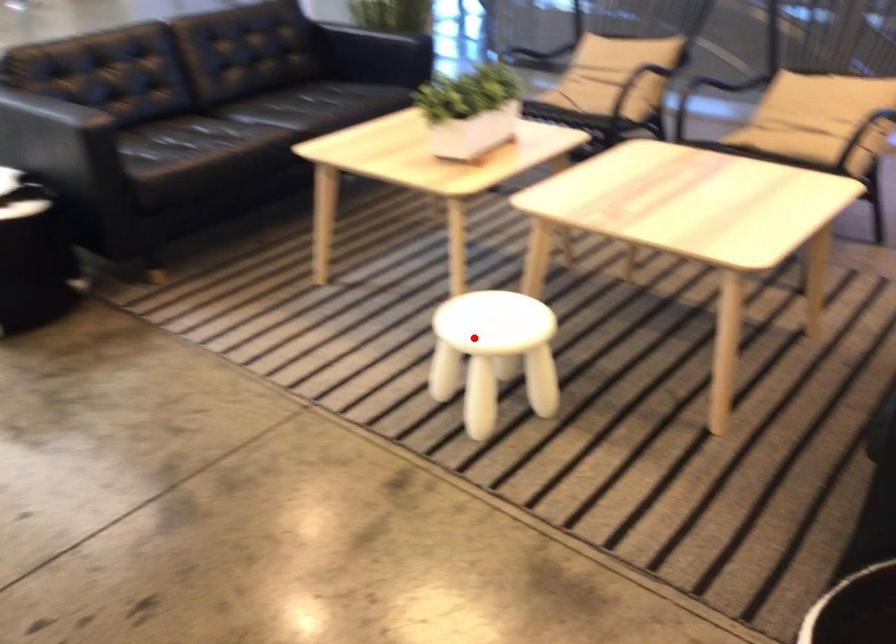
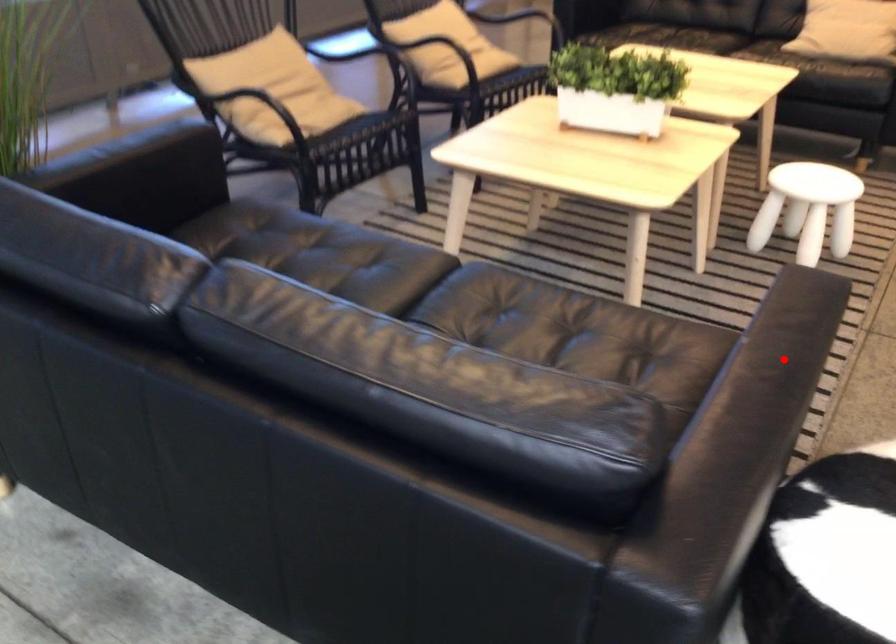
I am providing you with two images of the same scene from different viewpoints. A red point is marked on the first image and another point is marked on the second image. Do the highlighted points in image1 and image2 indicate the same real-world spot?

No